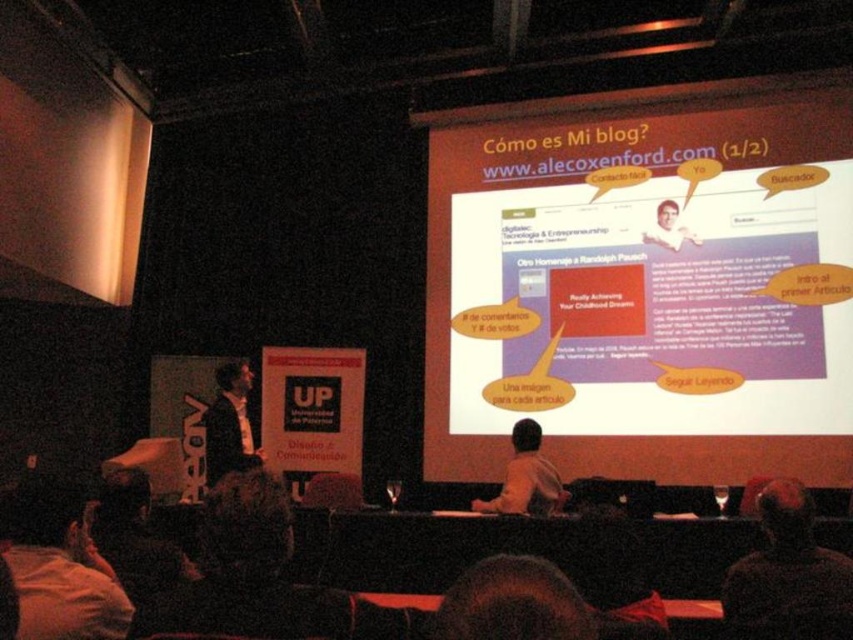
You are sitting in the front row of the auditorium and want to hand a note to the presenter wearing the dark brown leather jacket at lower right and the presenter with the light brown shirt at center. Which presenter should you approach first based on their proximity to you?

You should approach the dark brown leather jacket at lower right first because it is closer to the viewer than the light brown shirt at center.

You are an attendee sitting in the back row of the auditorium. You want to see both the white glossy projection screen at upper center and the light brown suit at center. Which object is higher in your field of view?

The white glossy projection screen at upper center is higher in your field of view than the light brown suit at center because it is positioned above it.